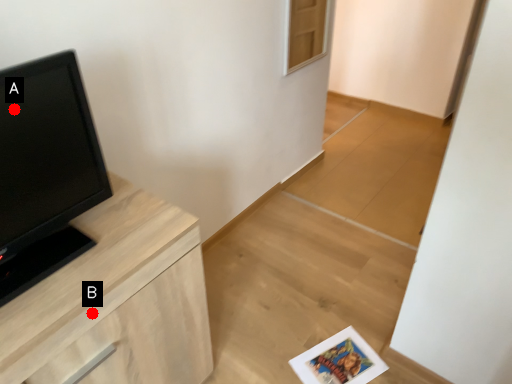
Question: Two points are circled on the image, labeled by A and B beside each circle. Which point is closer to the camera?

Choices:
 (A) A is closer
 (B) B is closer

Answer: (A)